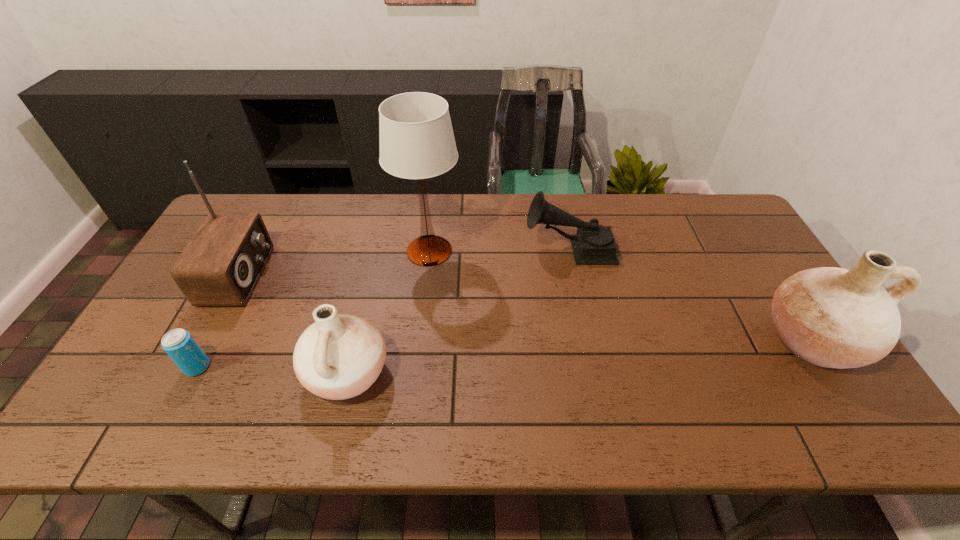
This screenshot has width=960, height=540. Identify the location of empty location between the right pottery and the shortest object. (504, 353).

Locate an element on the screen. This screenshot has width=960, height=540. vacant space that is in between the shortest object and the radio receiver is located at coordinates (218, 321).

The image size is (960, 540). What are the coordinates of `free space between the soda can and the left pottery` in the screenshot? It's located at (273, 370).

Locate an element on the screen. free area in between the taller pottery and the left pottery is located at coordinates (580, 356).

Locate an element on the screen. The width and height of the screenshot is (960, 540). free spot between the phonograph_record and the taller pottery is located at coordinates (690, 294).

The width and height of the screenshot is (960, 540). In order to click on unoccupied position between the radio receiver and the fifth object from left to right in this screenshot , I will do `click(404, 262)`.

Where is `free spot between the table lamp and the shortest object`? Image resolution: width=960 pixels, height=540 pixels. free spot between the table lamp and the shortest object is located at coordinates (313, 309).

What are the coordinates of `free space between the shorter pottery and the radio receiver` in the screenshot? It's located at tap(294, 325).

Find the location of a particular element. The image size is (960, 540). free space between the right pottery and the second object from right to left is located at coordinates (690, 294).

Identify which object is the fourth nearest to the soda can. Please provide its 2D coordinates. Your answer should be formatted as a tuple, i.e. [(x, y)], where the tuple contains the x and y coordinates of a point satisfying the conditions above.

[(593, 244)]